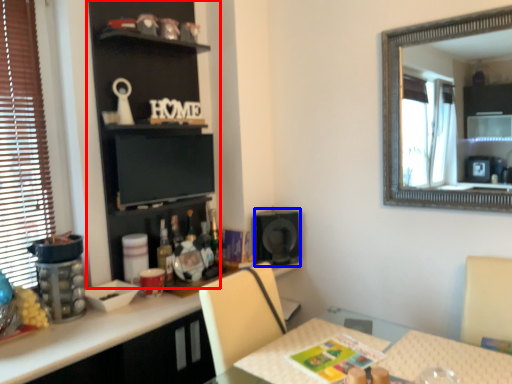
Question: Which object is further to the camera taking this photo, bookshelf (highlighted by a red box) or speaker (highlighted by a blue box)?

Choices:
 (A) bookshelf
 (B) speaker

Answer: (B)